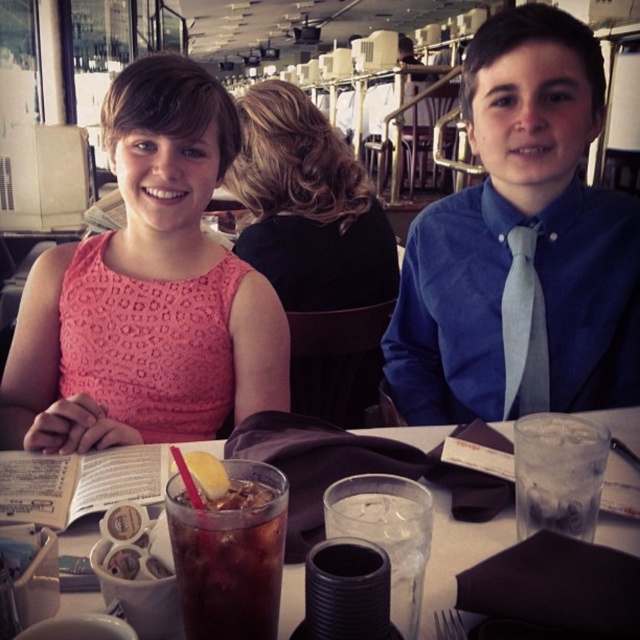
You are a waiter in a restaurant. You need to place a new order of a salad at the table. The salad should be placed at the position with coordinates point (230, 554). However, there is already an object at that location. What is the object located at point 0.861, 0.361?

The point (230, 554) is on dark brown glass at center, so the object at that location is the dark brown glass at center.

You are a photographer setting up for a group photo. You need to ensure that the pink lace dress at center and the light gray silk tie at right are both visible in the frame. Considering their heights, which object should you position closer to the camera to ensure both are fully visible?

The pink lace dress at center is taller than the light gray silk tie at right. To ensure both are fully visible, position the light gray silk tie at right closer to the camera so that its shorter height doesn not get obscured by the taller dress.